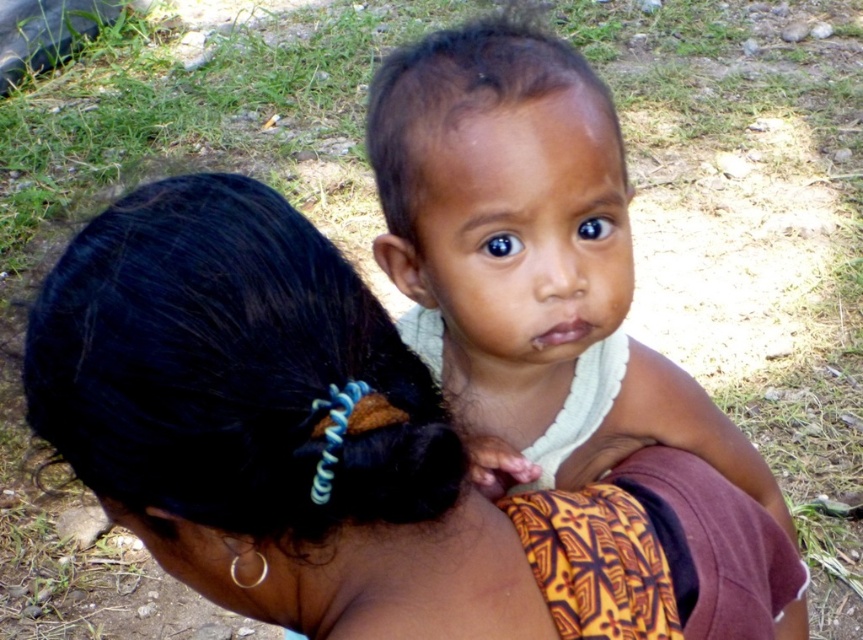
You are a photographer trying to capture a portrait of the black hair at upper left and the smooth skin baby at center. Since you want to ensure both subjects are in focus, you need to know their heights. Which subject is shorter?

The black hair at upper left is shorter than the smooth skin baby at center.

You are a photographer trying to capture a portrait of the black hair at upper left and the smooth skin baby at center. If you want to ensure both subjects are in focus, which subject should you adjust your camera focus to prioritize based on their sizes?

The black hair at upper left has a larger width than the smooth skin baby at center, so you should prioritize focusing on the black hair at upper left to ensure both are in focus.

You are a photographer trying to capture a close shot of the black hair at upper left and the smooth skin baby at center. Which object is positioned closer to the camera?

The black hair at upper left is closer to the viewer than the smooth skin baby at center, so it will appear closer to the camera.